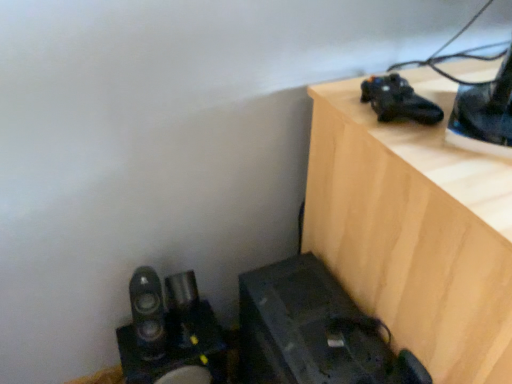
Where is `unoccupied area behind black matte shoe at upper right`? The width and height of the screenshot is (512, 384). unoccupied area behind black matte shoe at upper right is located at coordinates (412, 76).